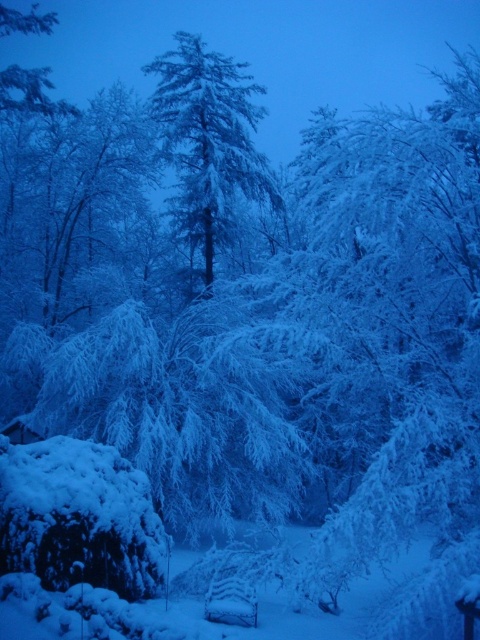
Question: Is snow-covered evergreen tree at center to the left of wooden park bench at center from the viewer's perspective?

Choices:
 (A) yes
 (B) no

Answer: (A)

Question: Can you confirm if snow-covered evergreen tree at center is positioned to the right of wooden park bench at center?

Choices:
 (A) no
 (B) yes

Answer: (A)

Question: Is snow-covered evergreen tree at center in front of wooden park bench at center?

Choices:
 (A) yes
 (B) no

Answer: (B)

Question: Which object appears closest to the camera in this image?

Choices:
 (A) snow-covered evergreen tree at center
 (B) wooden park bench at center

Answer: (B)